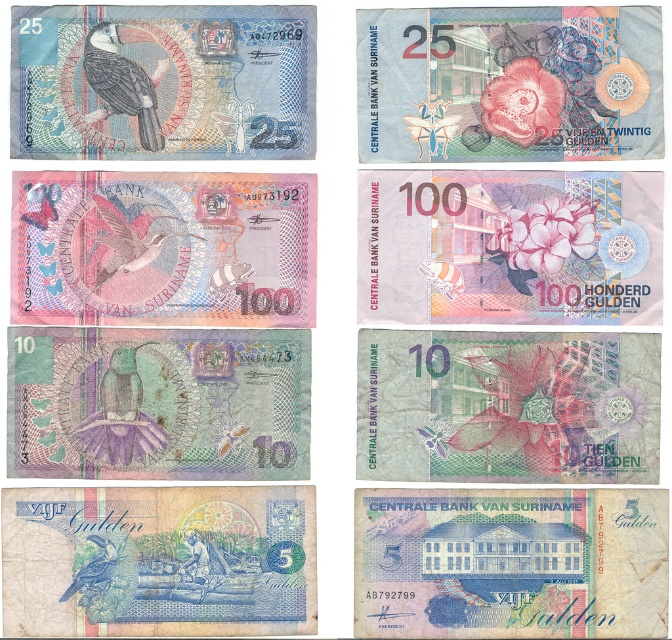
You are examining a grid of Surinamese currency notes. You notice a point marked at coordinates (509, 563). Which currency note does this point correspond to?

The point (509, 563) corresponds to the blue paper currency at bottom right.

You are standing in front of the image and notice two points labeled as point (x=476, y=554) and point (x=93, y=72). Which point is closer to you?

Point (x=476, y=554) is closer to you because it is in front of point (x=93, y=72).